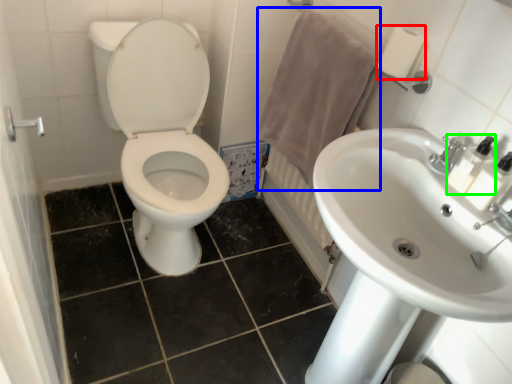
Question: Based on their relative distances, which object is farther from toilet paper (highlighted by a red box)? Choose from bath towel (highlighted by a blue box) and soap dispenser (highlighted by a green box).

Choices:
 (A) bath towel
 (B) soap dispenser

Answer: (B)